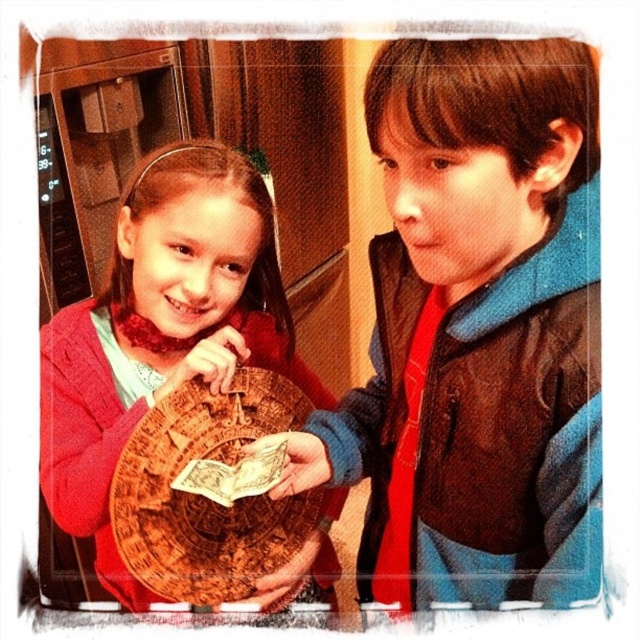
Question: Is blue fleece jacket at upper right above matte brown wooden puzzle at center?

Choices:
 (A) no
 (B) yes

Answer: (B)

Question: Does matte brown wooden puzzle at center have a larger size compared to wooden puzzle piece at center?

Choices:
 (A) no
 (B) yes

Answer: (B)

Question: Among these objects, which one is nearest to the camera?

Choices:
 (A) matte brown wooden puzzle at center
 (B) blue fleece jacket at upper right
 (C) wooden puzzle piece at center

Answer: (B)

Question: Which object is the farthest from the matte brown wooden puzzle at center?

Choices:
 (A) blue fleece jacket at upper right
 (B) wooden puzzle piece at center

Answer: (A)

Question: Is matte brown wooden puzzle at center wider than wooden puzzle piece at center?

Choices:
 (A) no
 (B) yes

Answer: (B)

Question: Which object is farther from the camera taking this photo?

Choices:
 (A) matte brown wooden puzzle at center
 (B) wooden puzzle piece at center

Answer: (B)